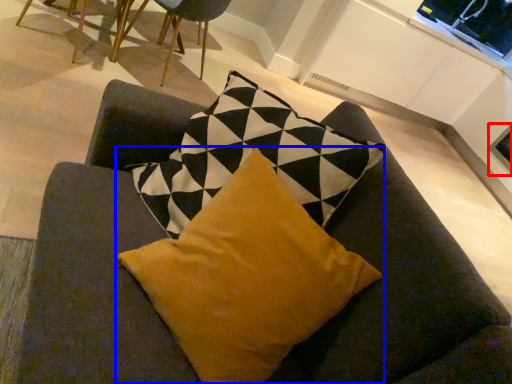
Question: Which point is closer to the camera, window screen (highlighted by a red box) or pillow (highlighted by a blue box)?

Choices:
 (A) window screen
 (B) pillow

Answer: (B)